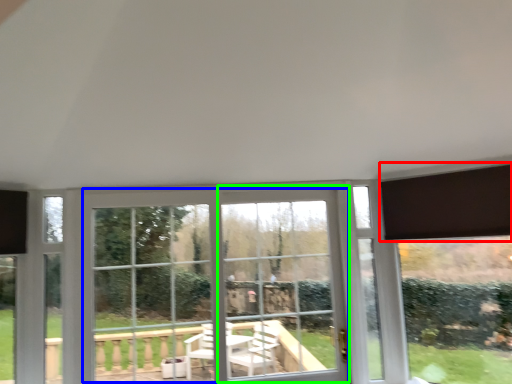
Question: Which object is positioned closest to curtain (highlighted by a red box)? Select from bay window (highlighted by a blue box) and window frame (highlighted by a green box).

Choices:
 (A) bay window
 (B) window frame

Answer: (B)